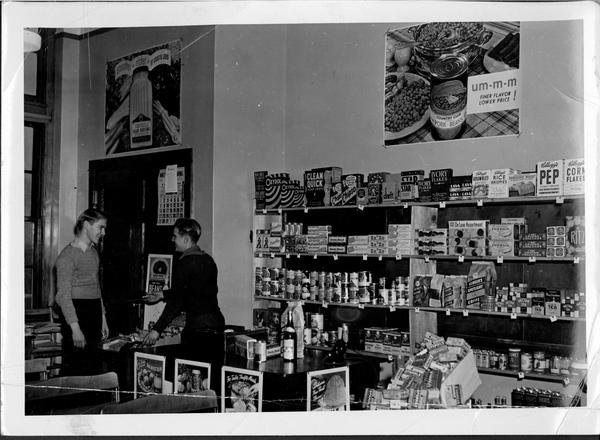
What are the coordinates of `doors` in the screenshot? It's located at (113, 226), (150, 239).